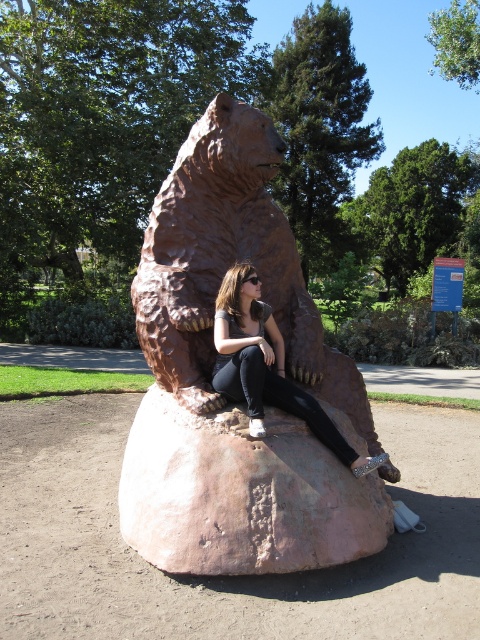
Can you confirm if brown stone bear at center is taller than matte bronze bear at center?

Yes.

Is point (149, 560) farther from viewer compared to point (233, 388)?

No, it is not.

Identify the location of brown stone bear at center. Image resolution: width=480 pixels, height=640 pixels. (222, 396).

Who is positioned more to the right, pink stone boulder at center or matte bronze bear at center?

matte bronze bear at center is more to the right.

Measure the distance between pink stone boulder at center and camera.

pink stone boulder at center is 2.66 meters away from camera.

The width and height of the screenshot is (480, 640). Find the location of `pink stone boulder at center`. pink stone boulder at center is located at coordinates (241, 493).

Is brown stone bear at center to the left of pink stone boulder at center from the viewer's perspective?

Indeed, brown stone bear at center is positioned on the left side of pink stone boulder at center.

Is brown stone bear at center thinner than pink stone boulder at center?

In fact, brown stone bear at center might be wider than pink stone boulder at center.

Does point (277, 468) come behind point (213, 547)?

Yes, point (277, 468) is farther from viewer.

I want to click on brown stone bear at center, so click(222, 396).